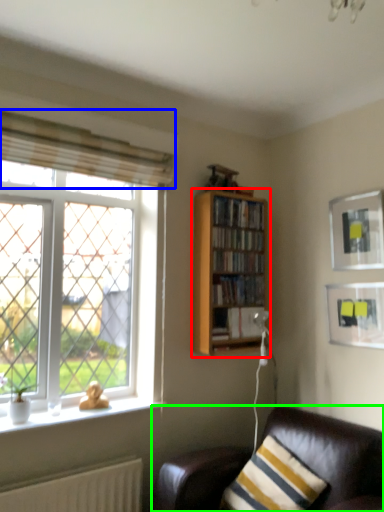
Question: Which is nearer to the bookcase (highlighted by a red box)? curtain (highlighted by a blue box) or studio couch (highlighted by a green box).

Choices:
 (A) curtain
 (B) studio couch

Answer: (A)